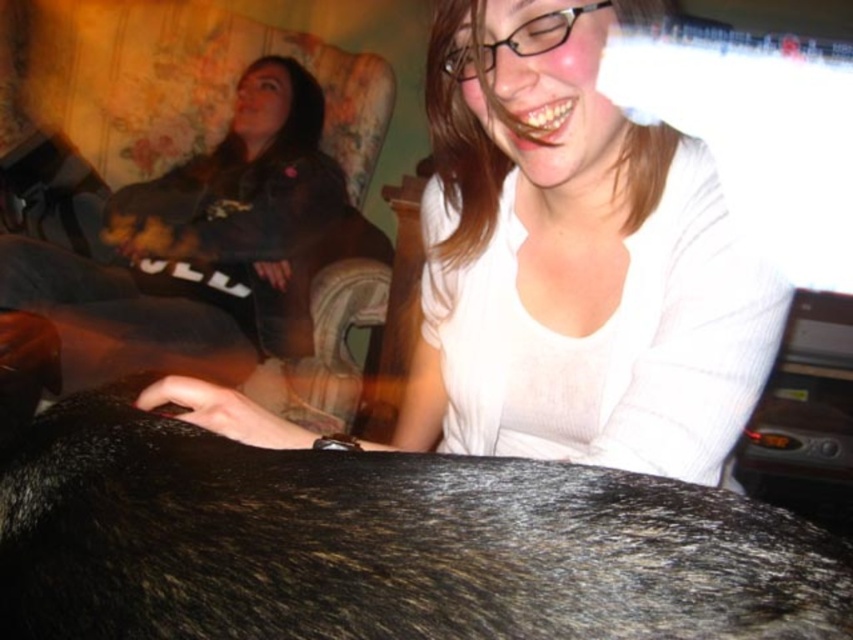
Question: Which is nearer to the dark gray hoodie at upper left?

Choices:
 (A) shiny black fur at center
 (B) white ribbed shirt at center

Answer: (B)

Question: Which point appears closest to the camera in this image?

Choices:
 (A) (x=193, y=576)
 (B) (x=183, y=330)
 (C) (x=561, y=150)

Answer: (A)

Question: Is shiny black fur at center positioned behind dark gray hoodie at upper left?

Choices:
 (A) no
 (B) yes

Answer: (A)

Question: Can you confirm if white ribbed shirt at center is bigger than dark gray hoodie at upper left?

Choices:
 (A) no
 (B) yes

Answer: (A)

Question: Which object is closer to the camera taking this photo?

Choices:
 (A) shiny black fur at center
 (B) dark gray hoodie at upper left

Answer: (A)

Question: Can you confirm if shiny black fur at center is smaller than white ribbed shirt at center?

Choices:
 (A) yes
 (B) no

Answer: (A)